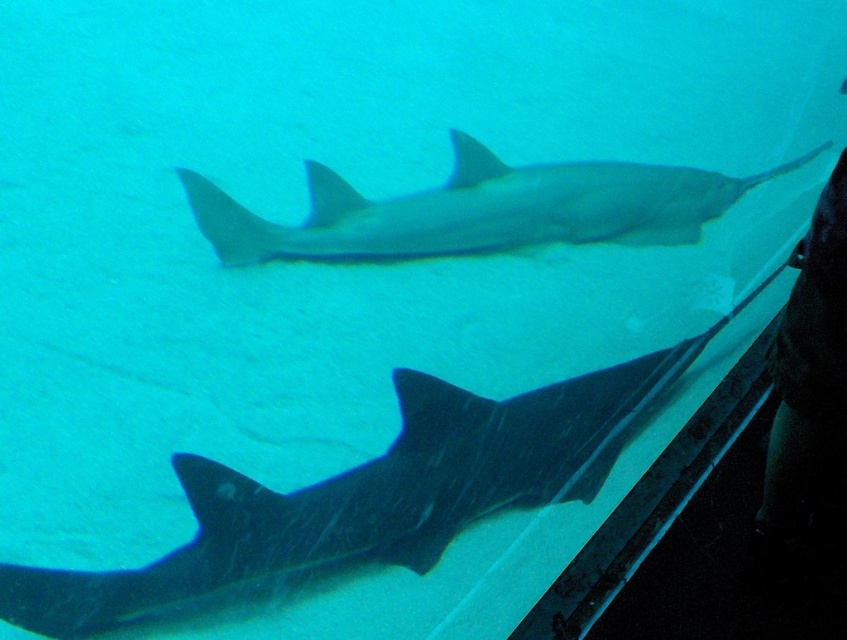
Is dark gray textured shark at center in front of smooth gray shark at center?

Yes, it is.

Which is more to the right, dark gray textured shark at center or smooth gray shark at center?

Positioned to the right is smooth gray shark at center.

Is point (241, 570) positioned in front of point (464, 236)?

Yes.

I want to click on dark gray textured shark at center, so click(360, 502).